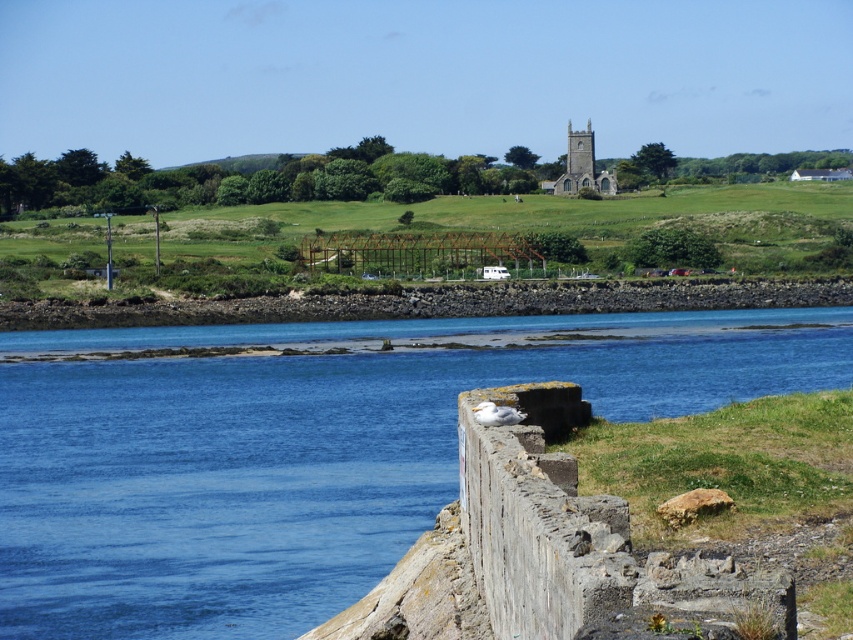
You are standing on the rocky shoreline and want to take a photo of the blue water at center and the stone church steeple at upper center. Which object should you point your camera towards first if you want to capture both in a single shot without moving the camera?

You should point your camera towards the blue water at center first because it is to the left of the stone church steeple at upper center, allowing both to be captured in the frame when positioned correctly.

You are standing on the rocky shoreline and want to reach the blue water at center without getting your feet wet. The stone church steeple at upper center is in your path. Can you walk around the steeple to reach the water?

The blue water at center is wider than the stone church steeple at upper center, so you can walk around the steeple to reach the water.